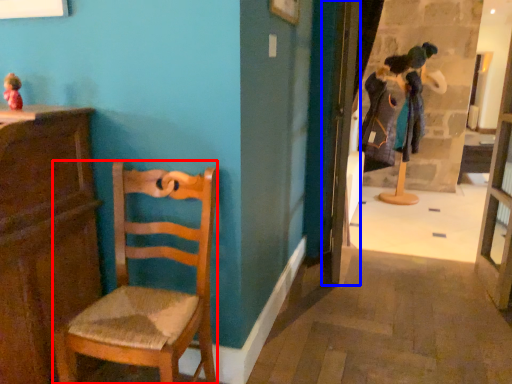
Question: Which of the following is the closest to the observer, chair (highlighted by a red box) or door (highlighted by a blue box)?

Choices:
 (A) chair
 (B) door

Answer: (A)